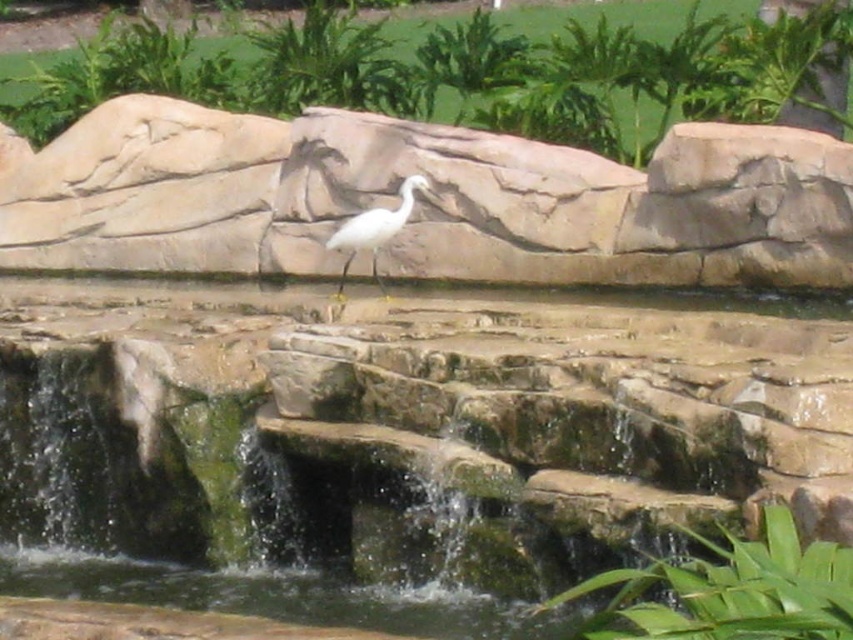
Question: Does smooth stone wall at center have a larger size compared to white smooth bird at center?

Choices:
 (A) yes
 (B) no

Answer: (A)

Question: Which point is closer to the camera?

Choices:
 (A) (367, 170)
 (B) (357, 236)

Answer: (B)

Question: Is smooth stone wall at center positioned at the back of white smooth bird at center?

Choices:
 (A) no
 (B) yes

Answer: (A)

Question: Which of the following is the farthest from the observer?

Choices:
 (A) white smooth bird at center
 (B) smooth stone wall at center

Answer: (A)

Question: Can you confirm if smooth stone wall at center is positioned above white smooth bird at center?

Choices:
 (A) no
 (B) yes

Answer: (B)